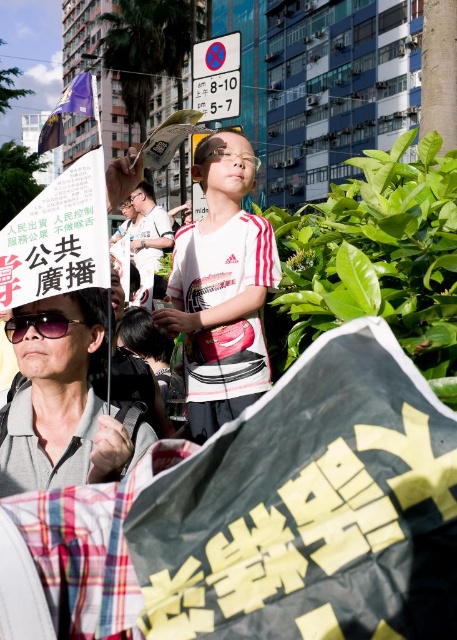
You are a photographer trying to capture the purple fabric flag at upper left and the black matte sunglasses at lower left in the same frame. Which object should you focus on first to ensure both fit in the shot, considering their sizes?

The purple fabric flag at upper left has a larger width than the black matte sunglasses at lower left. To ensure both fit in the frame, focus on the larger object first, which is the purple fabric flag at upper left.